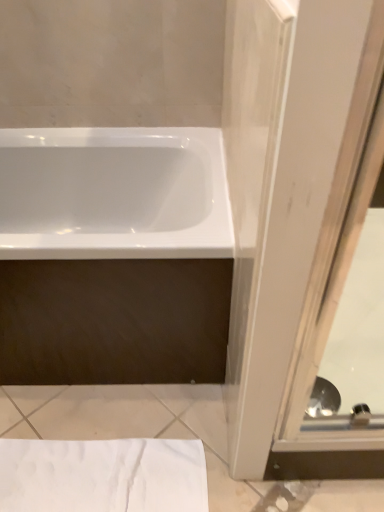
Question: Does clear glass screen door at right have a greater width compared to white glossy bathtub at center?

Choices:
 (A) no
 (B) yes

Answer: (B)

Question: Is clear glass screen door at right further to camera compared to white glossy bathtub at center?

Choices:
 (A) no
 (B) yes

Answer: (A)

Question: From a real-world perspective, does clear glass screen door at right sit lower than white glossy bathtub at center?

Choices:
 (A) no
 (B) yes

Answer: (B)

Question: From the image's perspective, is clear glass screen door at right on top of white glossy bathtub at center?

Choices:
 (A) yes
 (B) no

Answer: (B)

Question: Can you confirm if clear glass screen door at right is shorter than white glossy bathtub at center?

Choices:
 (A) yes
 (B) no

Answer: (A)

Question: Considering the relative positions of clear glass screen door at right and white glossy bathtub at center in the image provided, is clear glass screen door at right to the left of white glossy bathtub at center from the viewer's perspective?

Choices:
 (A) yes
 (B) no

Answer: (B)

Question: Considering the relative positions of clear glass screen door at right and white textured towel at lower left in the image provided, is clear glass screen door at right behind white textured towel at lower left?

Choices:
 (A) no
 (B) yes

Answer: (A)

Question: Does clear glass screen door at right have a lesser width compared to white textured towel at lower left?

Choices:
 (A) yes
 (B) no

Answer: (B)

Question: Could you tell me if clear glass screen door at right is turned towards white textured towel at lower left?

Choices:
 (A) yes
 (B) no

Answer: (B)

Question: Can you confirm if clear glass screen door at right is positioned to the right of white textured towel at lower left?

Choices:
 (A) no
 (B) yes

Answer: (B)

Question: Does clear glass screen door at right appear on the left side of white textured towel at lower left?

Choices:
 (A) yes
 (B) no

Answer: (B)

Question: From a real-world perspective, is clear glass screen door at right on white textured towel at lower left?

Choices:
 (A) no
 (B) yes

Answer: (B)

Question: Can you confirm if white textured towel at lower left is positioned to the right of clear glass screen door at right?

Choices:
 (A) no
 (B) yes

Answer: (A)